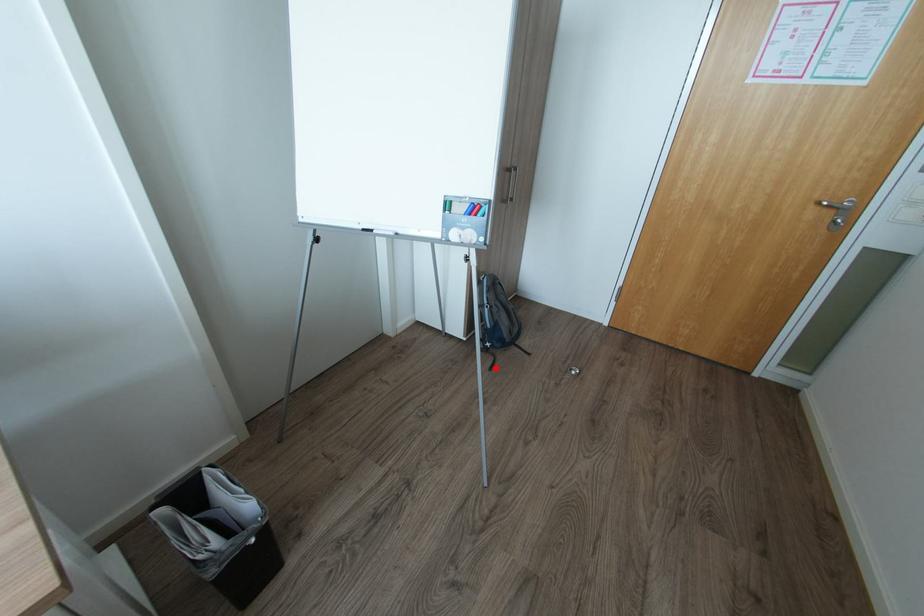
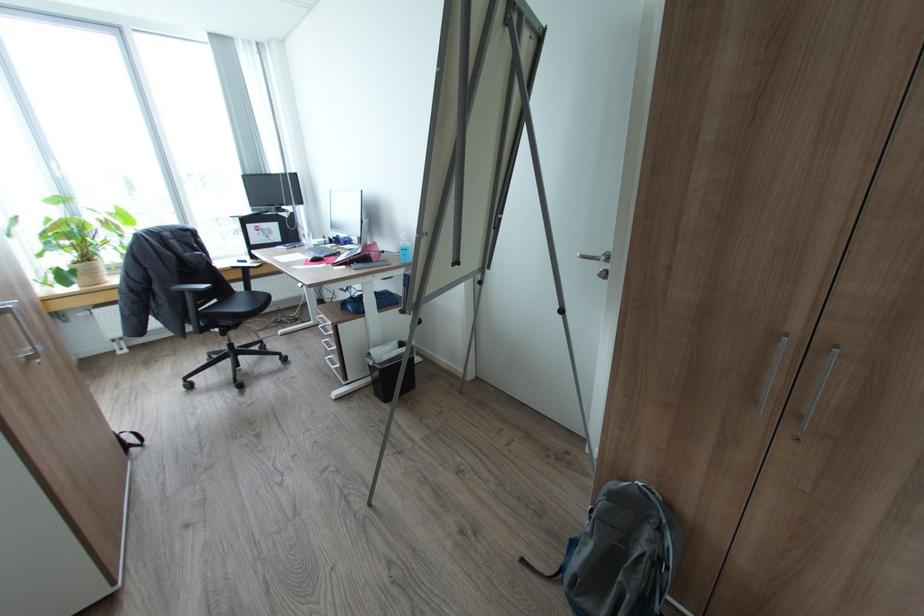
Question: I am providing you with two images of the same scene from different viewpoints. Image1 has a red point marked. In image2, the corresponding 3D location appears at what relative position? Reply with the corresponding letter.

Choices:
 (A) Closer
 (B) Farther

Answer: (A)